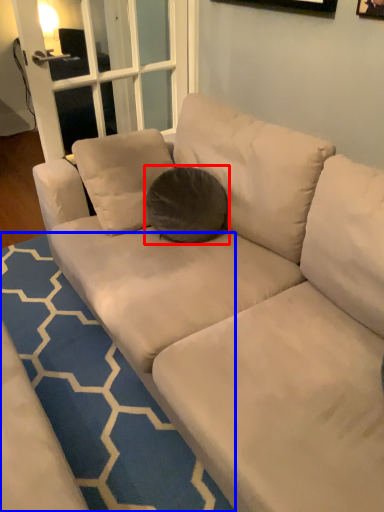
Question: Which point is further to the camera, throw pillow (highlighted by a red box) or doormat (highlighted by a blue box)?

Choices:
 (A) throw pillow
 (B) doormat

Answer: (A)